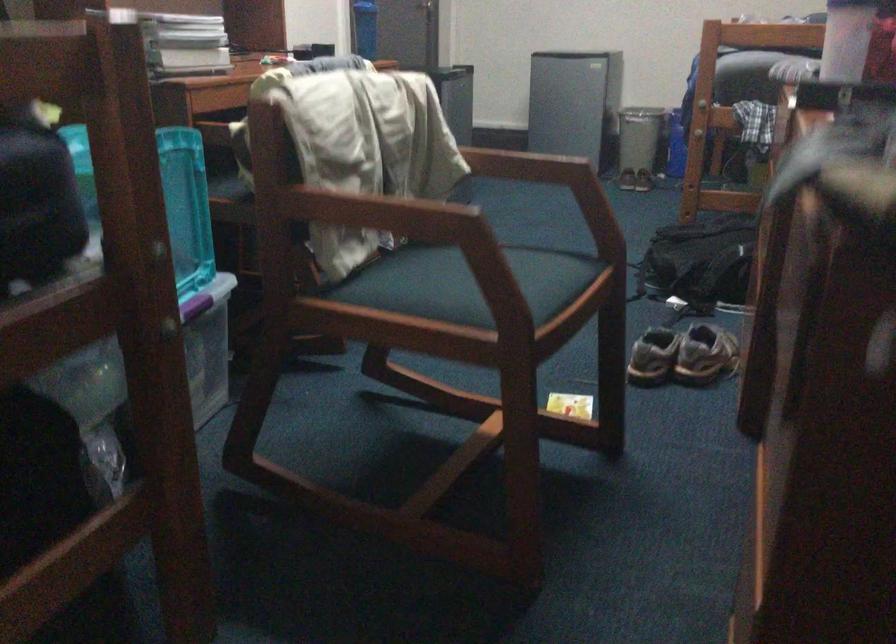
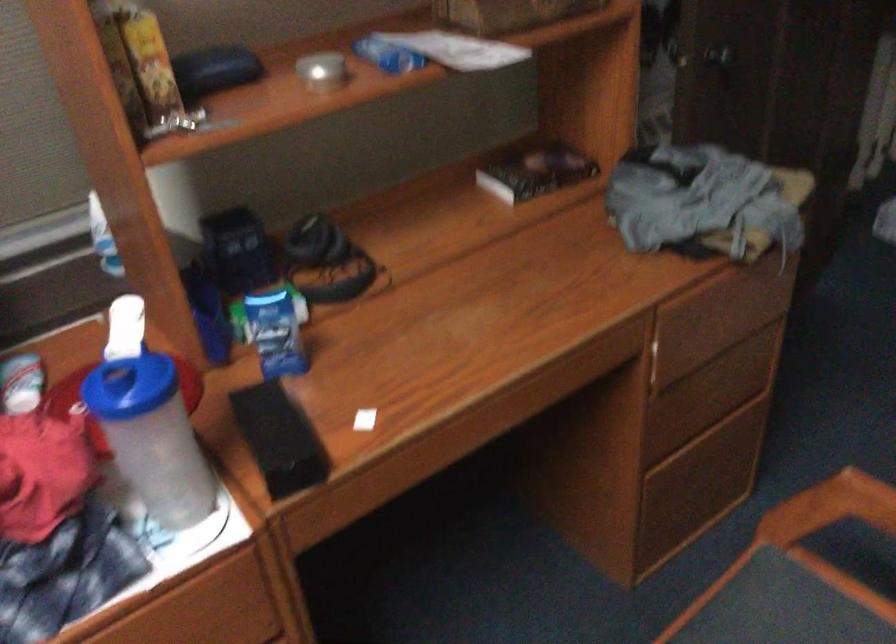
In the second image, find the point that corresponds to point (540, 325) in the first image.

(780, 614)